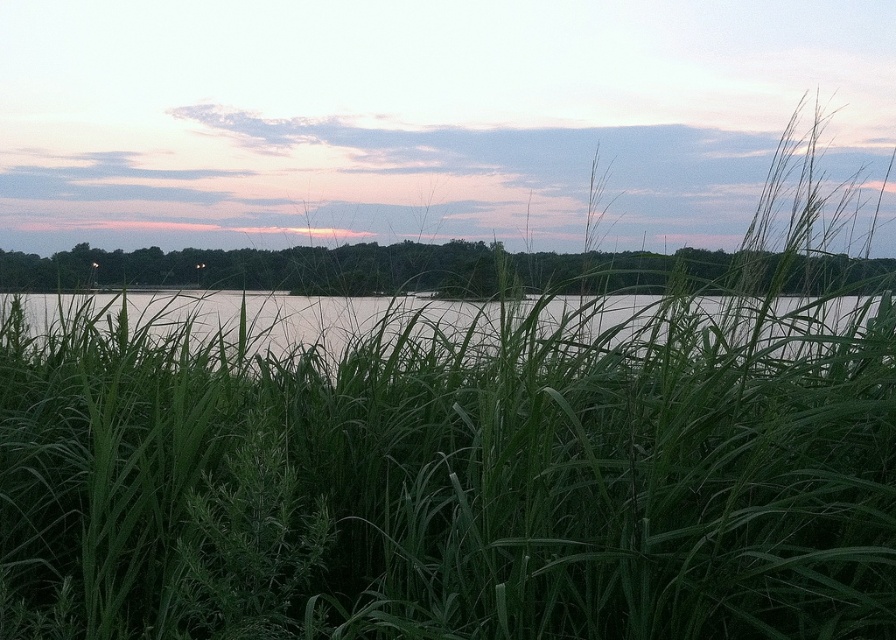
You are standing at the edge of the lake and see both the green grass at center and the clear water at center. Which object is located to the right of the other?

The green grass at center is positioned on the right side of clear water at center.

You are standing at the lakeside and want to take a photo of the green grass at center and the clear water at center. Which object will appear closer to the camera in the photo?

The green grass at center will appear closer to the camera because it is positioned in front of the clear water at center.